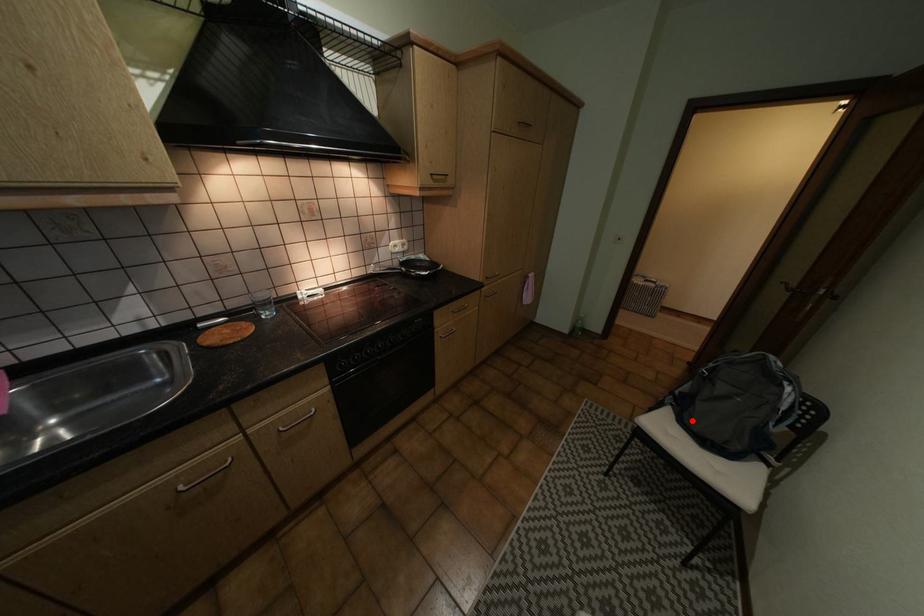
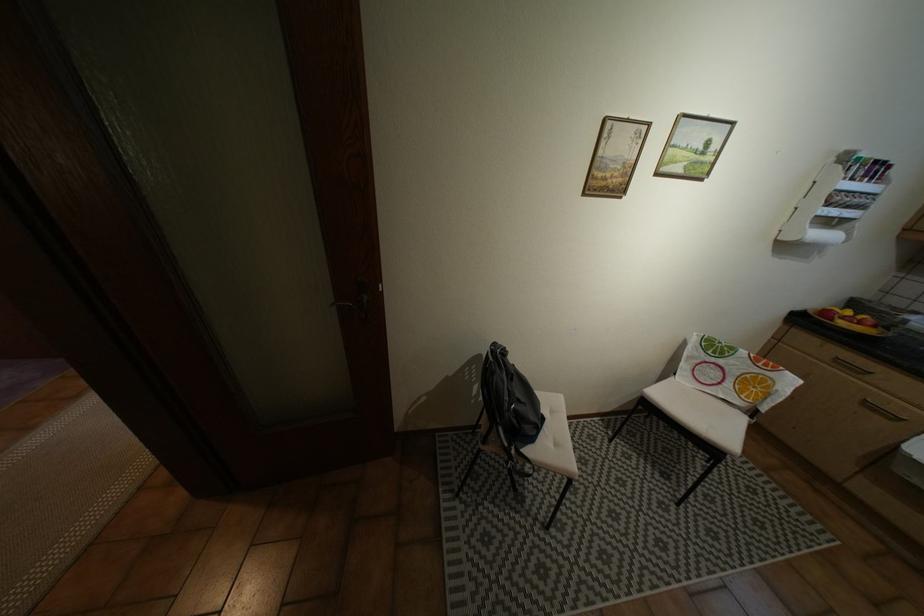
The point at the highlighted location is marked in the first image. Where is the corresponding point in the second image?

(542, 438)